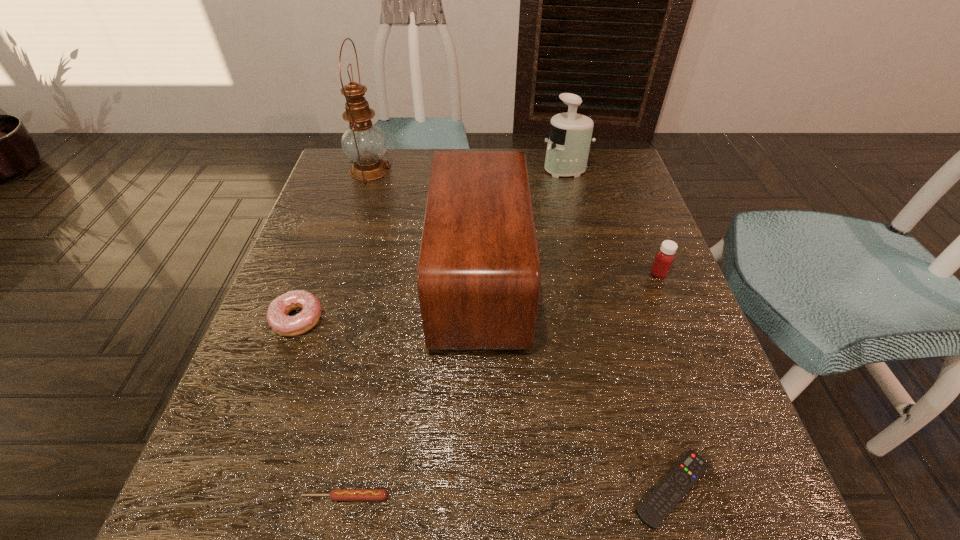
This screenshot has width=960, height=540. In the image, there is a desktop. Find the location of `vacant area at the near edge`. vacant area at the near edge is located at coordinates (538, 511).

The width and height of the screenshot is (960, 540). In the image, there is a desktop. Identify the location of vacant area at the left edge. (349, 242).

You are a GUI agent. You are given a task and a screenshot of the screen. Output one action in this format:
    pyautogui.click(x=<x>, y=<y>)
    Task: Click on the vacant space at the right edge of the desktop
    The height and width of the screenshot is (540, 960).
    Given the screenshot: What is the action you would take?
    pyautogui.click(x=632, y=259)

Find the location of `free space at the far left corner of the desktop`. free space at the far left corner of the desktop is located at coordinates (339, 192).

At what (x,y) coordinates should I click in order to perform the action: click on free space between the fifth tallest object and the tallest object. Please return your answer as a coordinate pair (x, y). This screenshot has height=540, width=960. Looking at the image, I should click on (334, 244).

The width and height of the screenshot is (960, 540). I want to click on free space that is in between the juicer and the remote control, so click(619, 329).

Where is `free spot between the fourth shortest object and the radio receiver`? free spot between the fourth shortest object and the radio receiver is located at coordinates (569, 276).

You are a GUI agent. You are given a task and a screenshot of the screen. Output one action in this format:
    pyautogui.click(x=<x>, y=<y>)
    Task: Click on the empty location between the third shortest object and the radio receiver
    The width and height of the screenshot is (960, 540).
    Given the screenshot: What is the action you would take?
    pyautogui.click(x=389, y=299)

This screenshot has height=540, width=960. In order to click on free point between the shortest object and the sausage in this screenshot , I will do `click(509, 492)`.

Identify the location of the sixth closest object to the third shortest object. (664, 258).